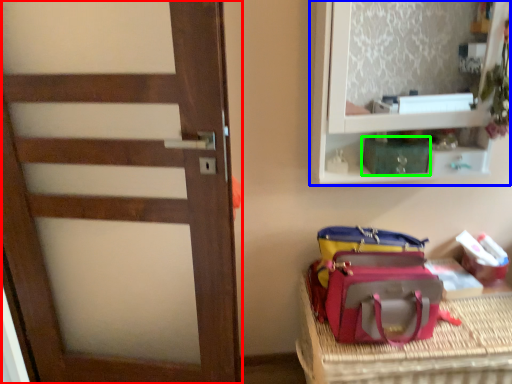
Question: Which is nearer to the door (highlighted by a red box)? shelf (highlighted by a blue box) or kit (highlighted by a green box).

Choices:
 (A) shelf
 (B) kit

Answer: (A)